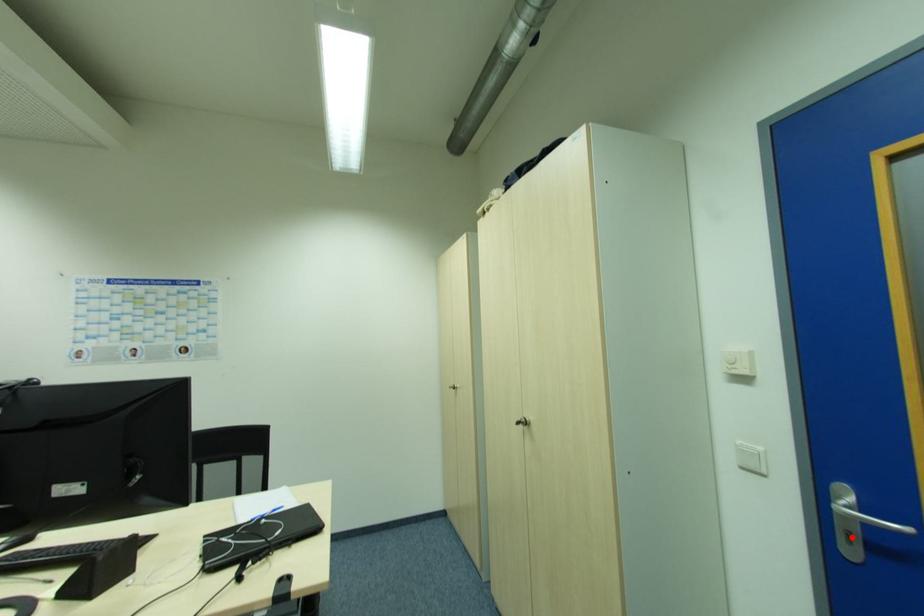
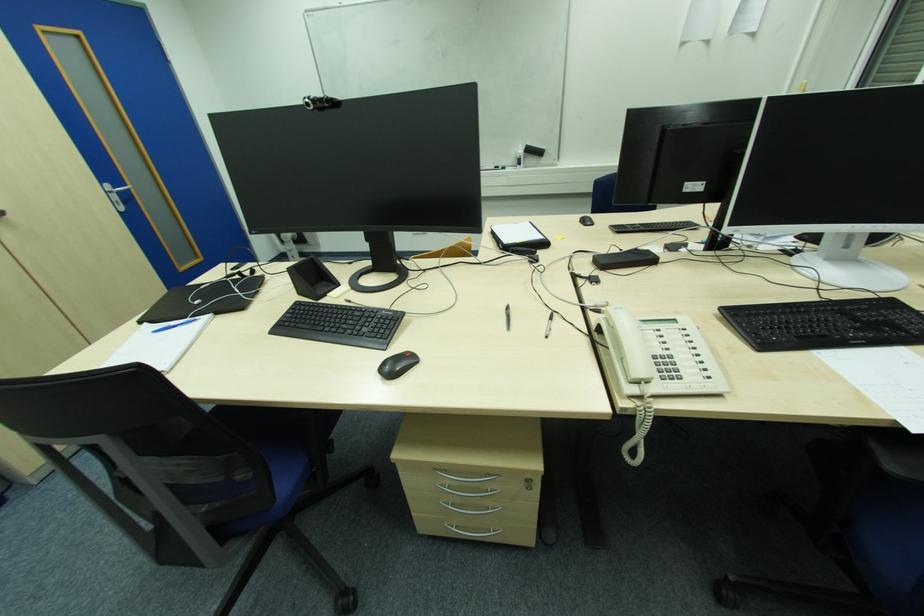
Locate, in the second image, the point that corresponds to the highlighted location in the first image.

(119, 204)